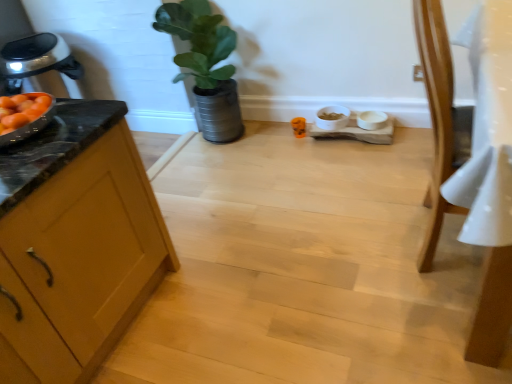
You are a GUI agent. You are given a task and a screenshot of the screen. Output one action in this format:
    pyautogui.click(x=<x>, y=<y>)
    Task: Click on the free space behind light brown wooden chair at right
    Image resolution: width=512 pixels, height=384 pixels.
    Given the screenshot: What is the action you would take?
    pyautogui.click(x=379, y=182)